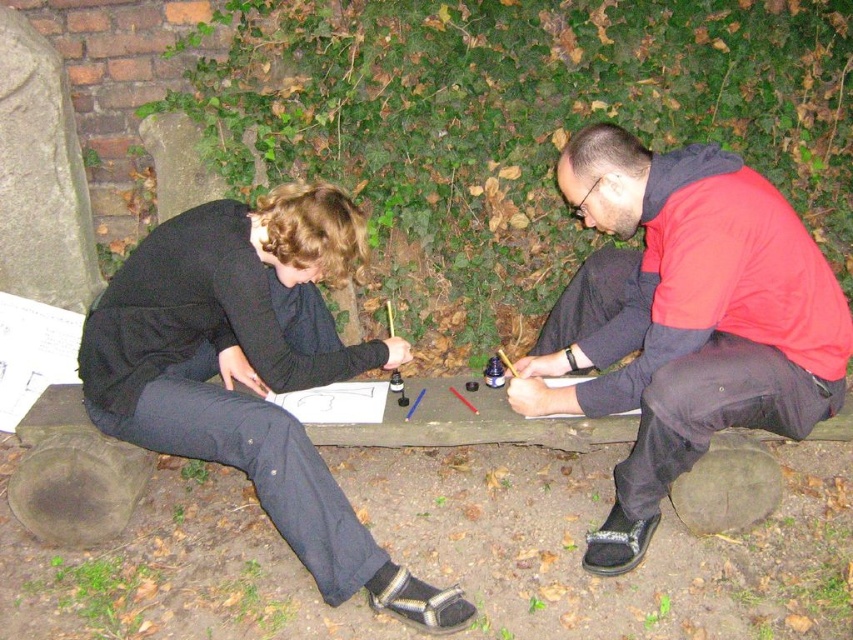
Does black fabric jacket at center have a lesser width compared to red fabric jacket at right?

In fact, black fabric jacket at center might be wider than red fabric jacket at right.

Which is behind, point (648, 195) or point (612, 387)?

Point (612, 387)

Locate an element on the screen. Image resolution: width=853 pixels, height=640 pixels. black fabric jacket at center is located at coordinates (683, 320).

Who is shorter, red fabric jacket at right or black matte pants at lower left?

Standing shorter between the two is black matte pants at lower left.

Measure the distance between red fabric jacket at right and camera.

They are 2.13 meters apart.

Where is `red fabric jacket at right`? This screenshot has width=853, height=640. red fabric jacket at right is located at coordinates (683, 317).

Can you confirm if black fabric jacket at center is positioned above black matte pants at lower left?

Indeed, black fabric jacket at center is positioned over black matte pants at lower left.

Can you confirm if black fabric jacket at center is taller than black matte pants at lower left?

Indeed, black fabric jacket at center has a greater height compared to black matte pants at lower left.

Which is behind, point (250, 364) or point (312, 547)?

Positioned behind is point (250, 364).

I want to click on black fabric jacket at center, so click(683, 320).